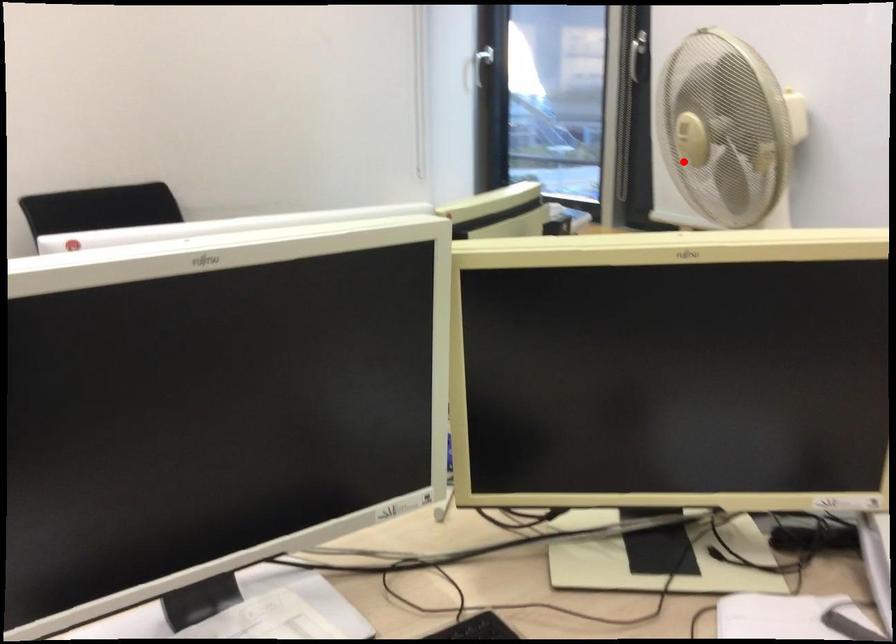
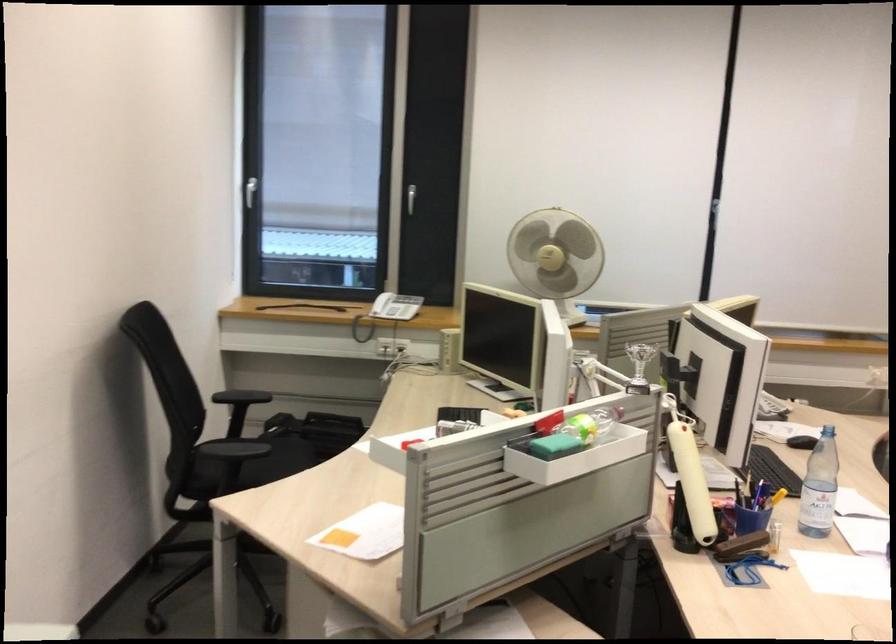
Question: A red point is marked in image1. In image2, is the corresponding 3D point closer to the camera or farther? Reply with the corresponding letter.

Choices:
 (A) The corresponding 3D point is closer.
 (B) The corresponding 3D point is farther.

Answer: (B)